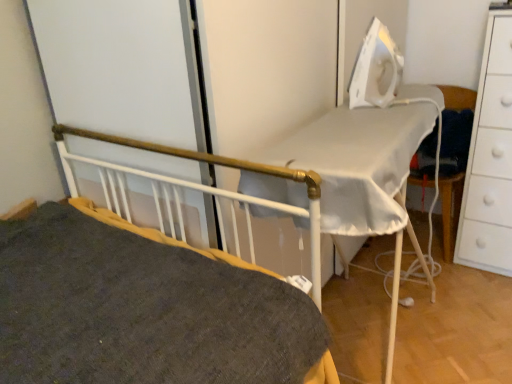
Question: Considering the relative positions of dark gray fabric bed at center and white plastic iron at upper right in the image provided, is dark gray fabric bed at center to the left of white plastic iron at upper right from the viewer's perspective?

Choices:
 (A) yes
 (B) no

Answer: (A)

Question: Would you say dark gray fabric bed at center is a long distance from white plastic iron at upper right?

Choices:
 (A) yes
 (B) no

Answer: (B)

Question: Is dark gray fabric bed at center located outside white plastic iron at upper right?

Choices:
 (A) no
 (B) yes

Answer: (B)

Question: From the image's perspective, is dark gray fabric bed at center located above white plastic iron at upper right?

Choices:
 (A) no
 (B) yes

Answer: (A)

Question: Can you confirm if dark gray fabric bed at center is shorter than white plastic iron at upper right?

Choices:
 (A) yes
 (B) no

Answer: (B)

Question: From a real-world perspective, is dark gray fabric bed at center positioned above or below white matte chest of drawers at right?

Choices:
 (A) below
 (B) above

Answer: (B)

Question: Considering the relative positions of dark gray fabric bed at center and white matte chest of drawers at right in the image provided, is dark gray fabric bed at center to the left or to the right of white matte chest of drawers at right?

Choices:
 (A) left
 (B) right

Answer: (A)

Question: Relative to white matte chest of drawers at right, is dark gray fabric bed at center in front or behind?

Choices:
 (A) behind
 (B) front

Answer: (B)

Question: Is point (321, 382) positioned closer to the camera than point (487, 26)?

Choices:
 (A) closer
 (B) farther

Answer: (A)

Question: In terms of width, does white matte chest of drawers at right look wider or thinner when compared to dark gray fabric bed at center?

Choices:
 (A) wide
 (B) thin

Answer: (B)

Question: Considering the positions of point (490, 109) and point (316, 203), is point (490, 109) closer or farther from the camera than point (316, 203)?

Choices:
 (A) closer
 (B) farther

Answer: (B)

Question: Is white matte chest of drawers at right bigger or smaller than dark gray fabric bed at center?

Choices:
 (A) small
 (B) big

Answer: (A)

Question: Considering the positions of white matte chest of drawers at right and dark gray fabric bed at center in the image, is white matte chest of drawers at right taller or shorter than dark gray fabric bed at center?

Choices:
 (A) tall
 (B) short

Answer: (A)

Question: From the image's perspective, relative to dark gray fabric bed at center, is white fabric chair at right above or below?

Choices:
 (A) below
 (B) above

Answer: (B)

Question: In terms of width, does white fabric chair at right look wider or thinner when compared to dark gray fabric bed at center?

Choices:
 (A) thin
 (B) wide

Answer: (A)